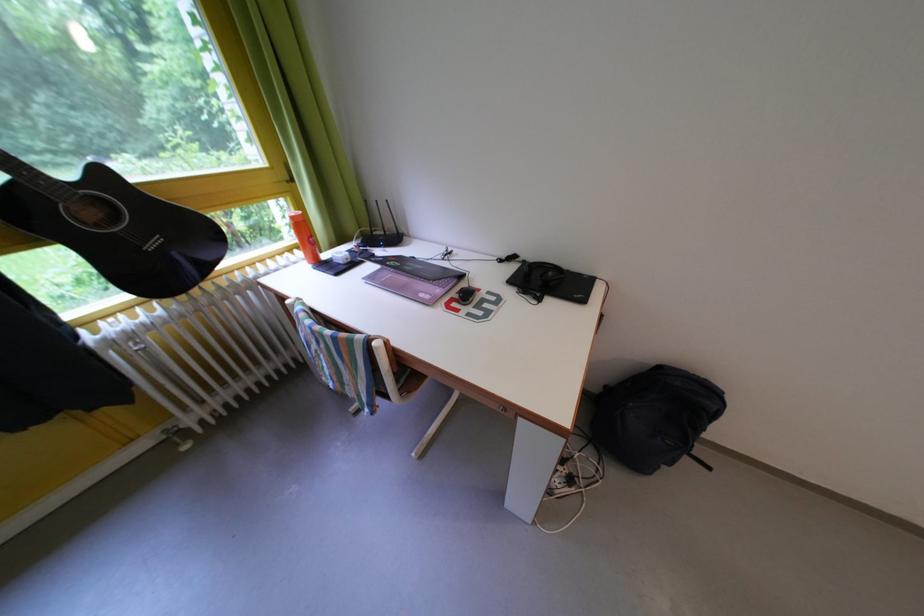
Which object does [466,294] point to?

This point indicates the black computer mouse.